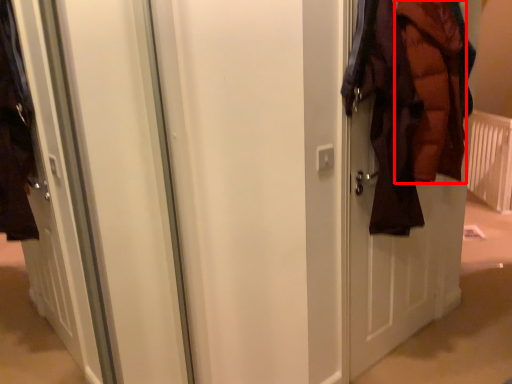
Question: Considering the relative positions of garment (annotated by the red box) and radiator in the image provided, where is garment (annotated by the red box) located with respect to the staircase?

Choices:
 (A) left
 (B) right

Answer: (A)